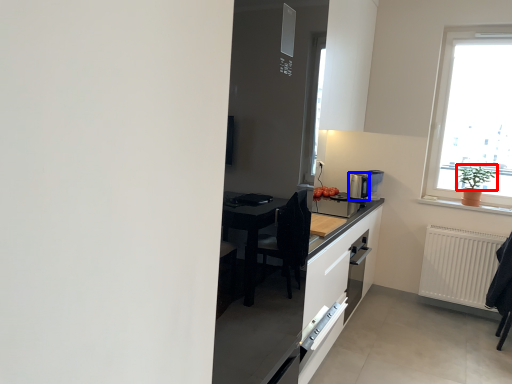
Question: Among these objects, which one is farthest to the camera, plant (highlighted by a red box) or coffee machine (highlighted by a blue box)?

Choices:
 (A) plant
 (B) coffee machine

Answer: (B)